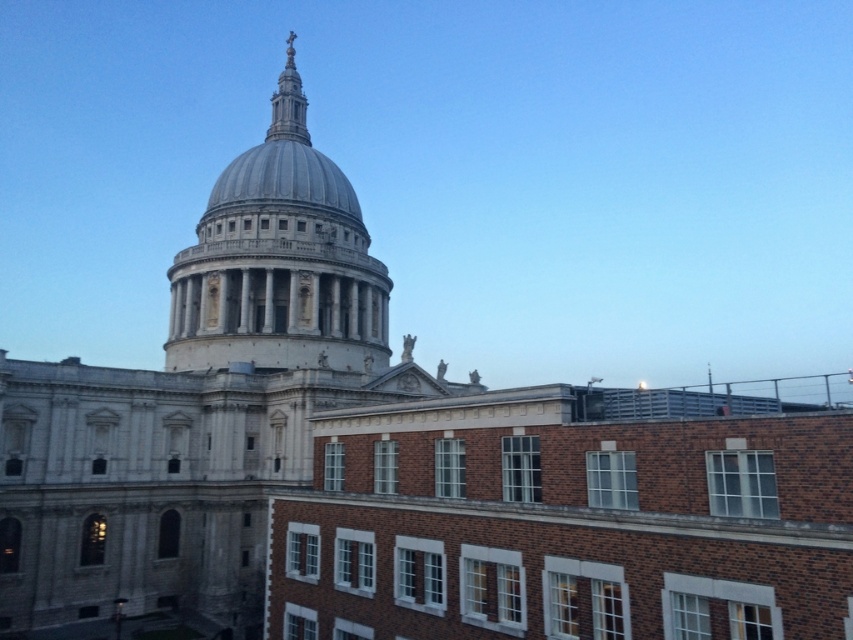
You are standing in a park across from the white marble dome at center. You want to take a photo of the dome without any obstructions. The park has a path that is 50 meters long leading towards the dome. Will you be able to reach the dome before the path ends?

The white marble dome at center is 58.73 meters from the viewer. Since the path is only 50 meters long, you will not reach the dome before the path ends as the distance to the dome is greater than the path length.

You are an architect visiting St. Paul Cathedral. You are standing in front of the cathedral and want to compare the size of the white marble dome at center and the gold metallic spire at upper center. Which one is wider?

The white marble dome at center is wider than the gold metallic spire at upper center.